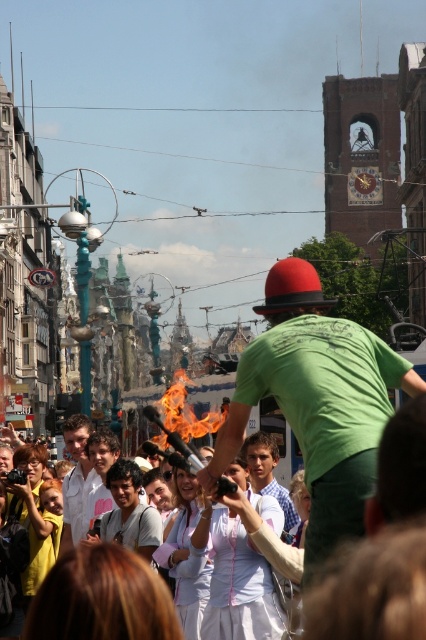
Who is positioned more to the right, green matte shirt at center or light brown hair at center?

green matte shirt at center is more to the right.

Can you confirm if green matte shirt at center is smaller than light brown hair at center?

Incorrect, green matte shirt at center is not smaller in size than light brown hair at center.

In order to click on green matte shirt at center in this screenshot , I will do `click(316, 401)`.

Where is `green matte shirt at center`? green matte shirt at center is located at coordinates (316, 401).

Is green matte shirt at center shorter than white shirt at center?

In fact, green matte shirt at center may be taller than white shirt at center.

Is green matte shirt at center positioned at the back of white shirt at center?

No, it is not.

The image size is (426, 640). In order to click on green matte shirt at center in this screenshot , I will do click(316, 401).

Between point (284, 310) and point (273, 458), which one is positioned behind?

Positioned behind is point (273, 458).

Is point (374, 396) positioned after point (273, 476)?

That is False.

Who is more distant from viewer, (345,502) or (252,468)?

Point (252,468)

Find the location of a particular element. green matte shirt at center is located at coordinates (316, 401).